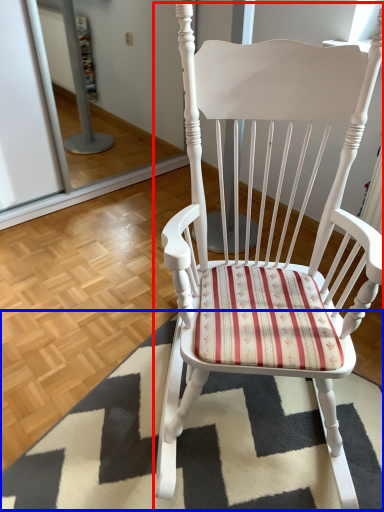
Question: Among these objects, which one is nearest to the camera, chair (highlighted by a red box) or doormat (highlighted by a blue box)?

Choices:
 (A) chair
 (B) doormat

Answer: (A)